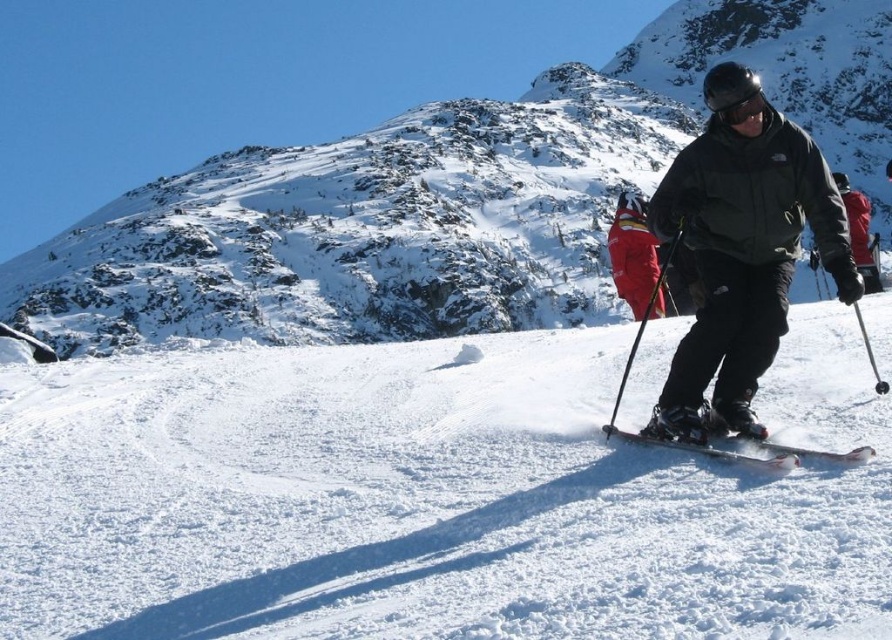
You are a photographer trying to capture the skier and the snow in the image. If you want to ensure both the white powder snow at center and the black plastic ski pole at center are visible in your shot, which object should you focus on first?

You should focus on the white powder snow at center first because it has a greater height compared to the black plastic ski pole at center, making it more prominent in the frame.

You are a photographer planning to capture the skier and the snow in the image. Since you want to ensure both the white powder snow at center and the dark green matte jacket at center right are visible in your shot, which object should you focus on first to avoid overexposure?

The white powder snow at center is bigger than the dark green matte jacket at center right, so focusing on the white powder snow at center first would help avoid overexposure as it covers a larger area and might require more exposure adjustment.

You are a photographer standing at the bottom of the slope. You want to take a photo of the skier and ensure both the white powder snow at center and the black plastic ski pole at center are clearly visible in the frame. Given the distance between them, will you need to adjust your camera lens to a wider angle to capture both objects in the same shot?

The white powder snow at center and black plastic ski pole at center are 9.37 meters apart. To capture both in the same frame, you would need to adjust your camera lens to a wider angle to accommodate the distance between them.